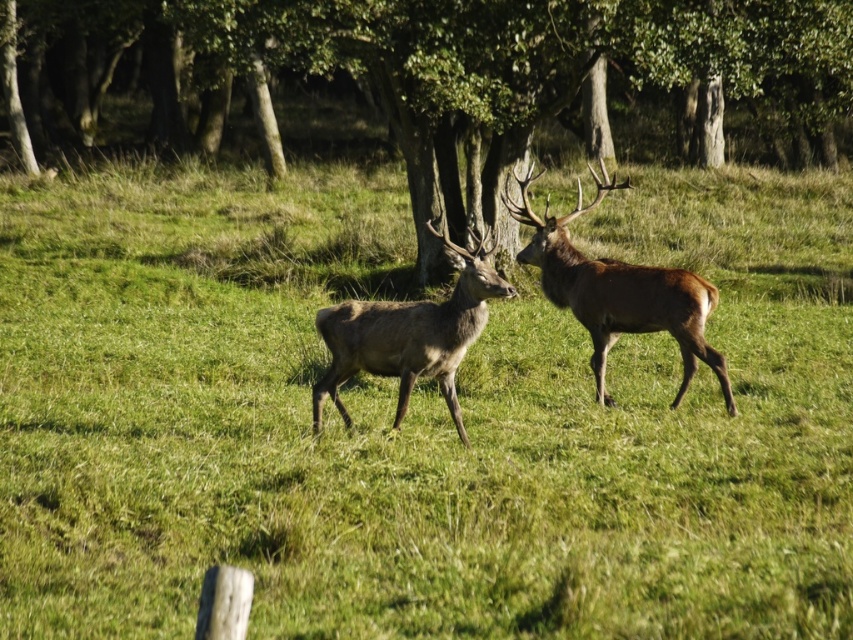
Question: Is brown velvet deer at center wider than brown matte/deer at center?

Choices:
 (A) no
 (B) yes

Answer: (B)

Question: Which object is closer to the camera taking this photo?

Choices:
 (A) brown velvet deer at center
 (B) brown matte/deer at center
 (C) green leafy tree at center

Answer: (B)

Question: Which of the following is the closest to the observer?

Choices:
 (A) (415, 196)
 (B) (370, 337)

Answer: (B)

Question: Which of the following is the farthest from the observer?

Choices:
 (A) [698, 337]
 (B) [380, 348]
 (C) [370, 13]

Answer: (C)

Question: In this image, where is green leafy tree at center located relative to brown velvet deer at center?

Choices:
 (A) above
 (B) below

Answer: (A)

Question: Does green leafy tree at center have a larger size compared to brown matte/deer at center?

Choices:
 (A) no
 (B) yes

Answer: (B)